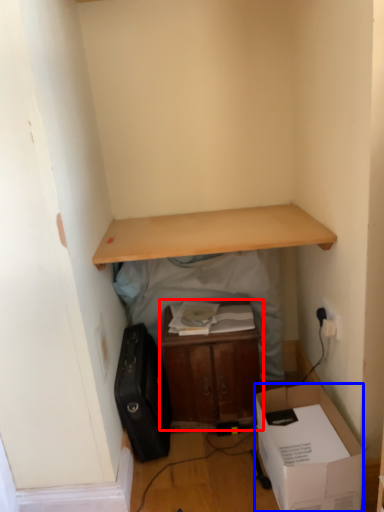
Question: Which of the following is the farthest to the observer, table (highlighted by a red box) or box (highlighted by a blue box)?

Choices:
 (A) table
 (B) box

Answer: (A)